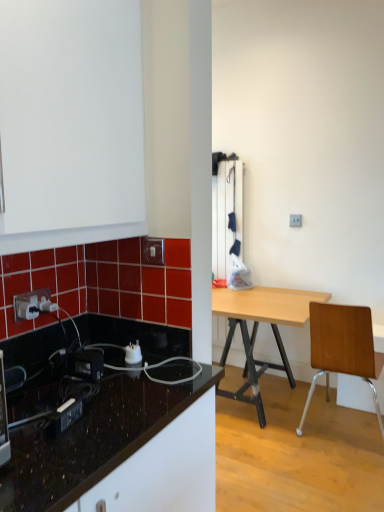
Image resolution: width=384 pixels, height=512 pixels. I want to click on free region on the left part of brown wooden chair at right, so click(261, 435).